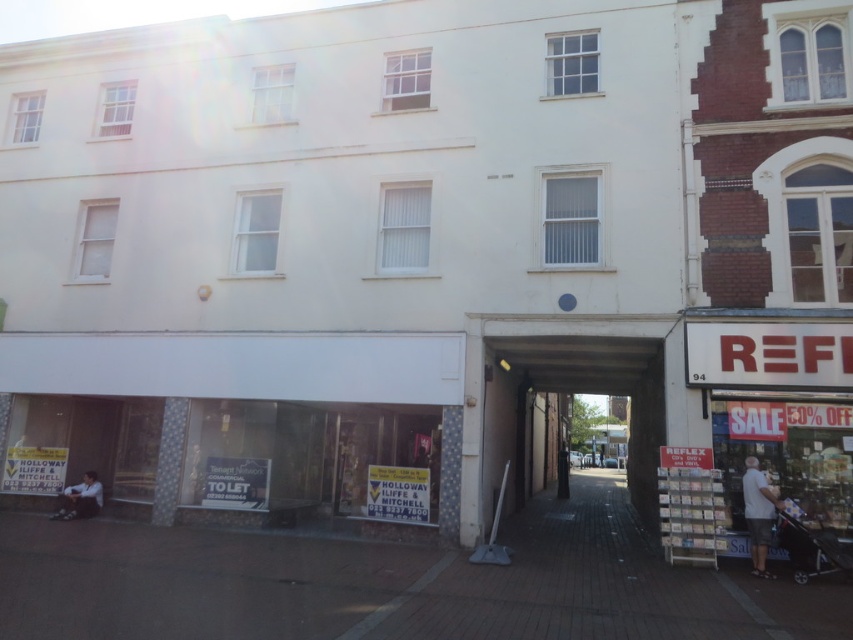
Measure the distance between point (747, 481) and camera.

Point (747, 481) and camera are 28.12 feet apart.

Is point (763, 500) less distant than point (82, 476)?

Yes, it is.

Between point (750, 490) and point (88, 474), which one is positioned behind?

The point (88, 474) is behind.

Find the location of a particular element. This screenshot has width=853, height=640. white cotton shirt at lower right is located at coordinates (758, 513).